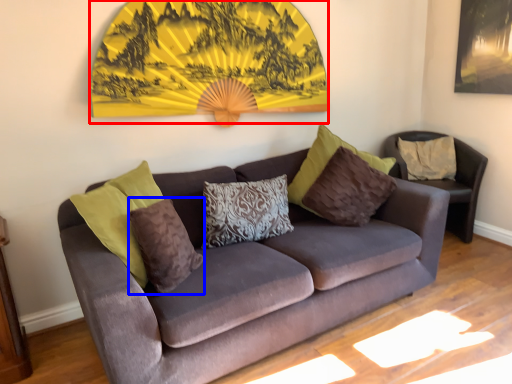
Question: Which object appears farthest to the camera in this image, decor (highlighted by a red box) or pillow (highlighted by a blue box)?

Choices:
 (A) decor
 (B) pillow

Answer: (A)